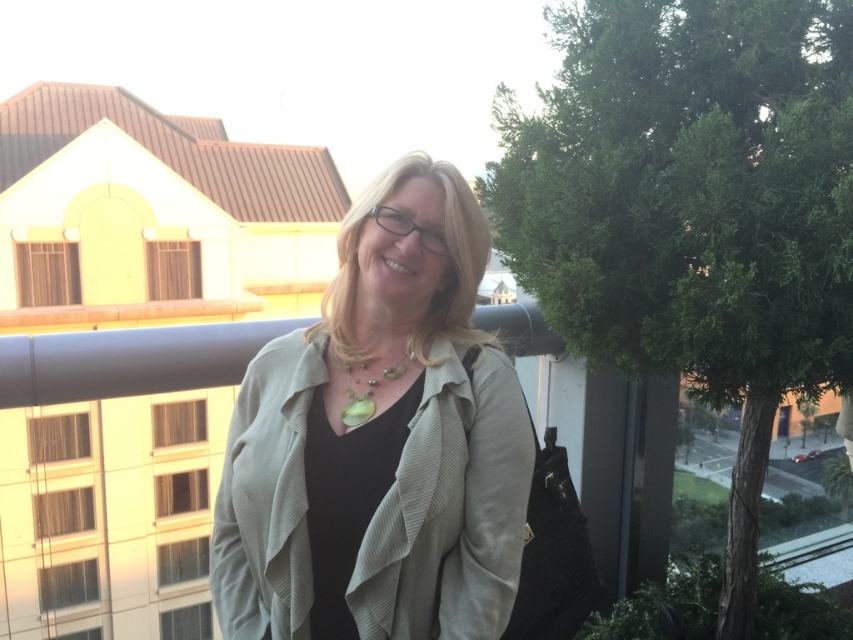
The woman is wearing a green pearl necklace at center and standing near a green leafy tree at right. Which object is bigger in size?

The green leafy tree at right is larger in size compared to the green pearl necklace at center.

You are a photographer trying to capture the matte beige jacket at center in a closeup shot. What coordinates should you aim for to ensure the jacket is centered in your frame?

To center the matte beige jacket at center in your frame, aim for the coordinates point (x=379, y=442) as specified in the description.

You are standing on the balcony where the woman is and want to take a photo of the street below. The green leafy tree at right is blocking part of the view. Where should you move to get a clearer view of the street?

Move to the left side of the balcony away from the green leafy tree at right to get a clearer view of the street below.